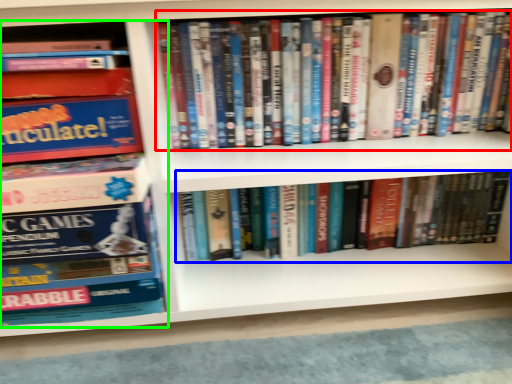
Question: Which is nearer to the book (highlighted by a red box)? book (highlighted by a blue box) or book (highlighted by a green box).

Choices:
 (A) book
 (B) book

Answer: (A)